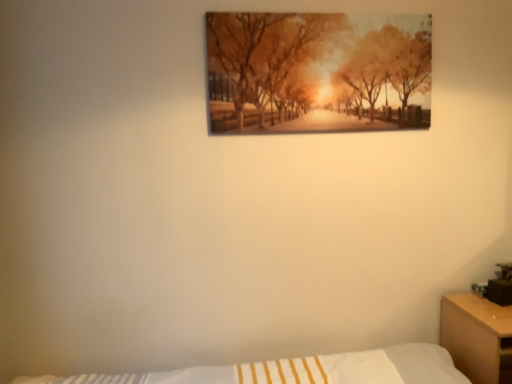
Question: Considering the relative sizes of matte wooden picture frame at upper center and matte black table lamp at right in the image provided, is matte wooden picture frame at upper center bigger than matte black table lamp at right?

Choices:
 (A) no
 (B) yes

Answer: (B)

Question: Is matte wooden picture frame at upper center facing towards matte black table lamp at right?

Choices:
 (A) yes
 (B) no

Answer: (B)

Question: Would you consider matte wooden picture frame at upper center to be distant from matte black table lamp at right?

Choices:
 (A) yes
 (B) no

Answer: (A)

Question: From the image's perspective, is matte wooden picture frame at upper center under matte black table lamp at right?

Choices:
 (A) yes
 (B) no

Answer: (B)

Question: Can you confirm if matte wooden picture frame at upper center is positioned to the left of matte black table lamp at right?

Choices:
 (A) yes
 (B) no

Answer: (A)

Question: From a real-world perspective, is matte wooden picture frame at upper center positioned under matte black table lamp at right based on gravity?

Choices:
 (A) yes
 (B) no

Answer: (B)

Question: Is matte wooden picture frame at upper center to the left of wooden nightstand at right from the viewer's perspective?

Choices:
 (A) no
 (B) yes

Answer: (B)

Question: From the image's perspective, would you say matte wooden picture frame at upper center is shown under wooden nightstand at right?

Choices:
 (A) yes
 (B) no

Answer: (B)

Question: Could you tell me if matte wooden picture frame at upper center is turned towards wooden nightstand at right?

Choices:
 (A) yes
 (B) no

Answer: (B)

Question: Could wooden nightstand at right be considered to be inside matte wooden picture frame at upper center?

Choices:
 (A) yes
 (B) no

Answer: (B)

Question: Is matte wooden picture frame at upper center facing away from wooden nightstand at right?

Choices:
 (A) no
 (B) yes

Answer: (A)

Question: Would you say matte wooden picture frame at upper center is a long distance from wooden nightstand at right?

Choices:
 (A) no
 (B) yes

Answer: (B)

Question: Is matte black table lamp at right in front of wooden nightstand at right?

Choices:
 (A) yes
 (B) no

Answer: (B)